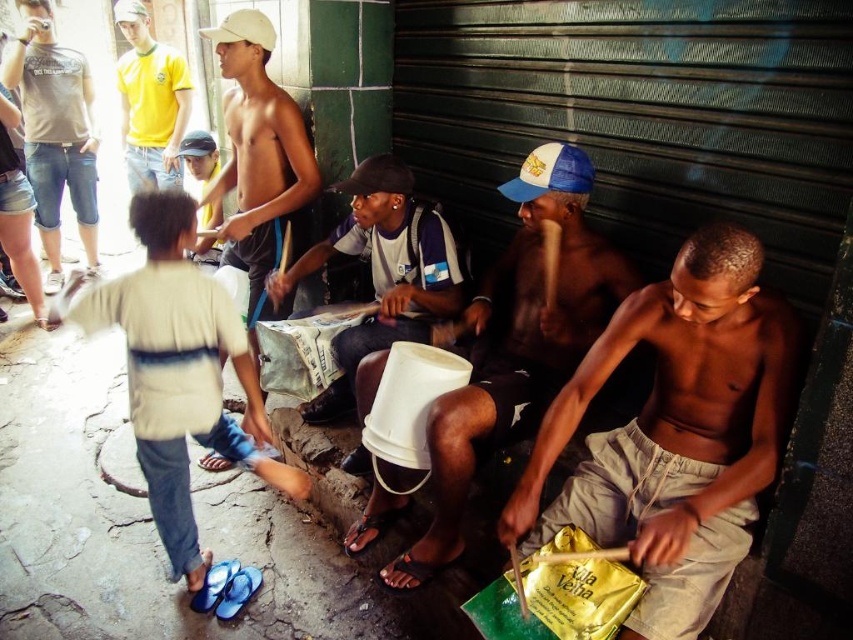
Question: Which point is farther from the camera taking this photo?

Choices:
 (A) (341, 184)
 (B) (184, 148)
 (C) (292, 291)

Answer: (B)

Question: Which object is closer to the camera taking this photo?

Choices:
 (A) black fabric cap at center
 (B) shiny white cap at upper left

Answer: (A)

Question: Among these objects, which one is farthest from the camera?

Choices:
 (A) matte gray t-shirt at center
 (B) shiny metallic boy at center

Answer: (A)

Question: Does shiny metallic boy at center have a larger size compared to white and blue fabric cap at upper center?

Choices:
 (A) no
 (B) yes

Answer: (B)

Question: Is light blue denim jeans at lower left smaller than shiny white cap at upper left?

Choices:
 (A) no
 (B) yes

Answer: (B)

Question: Can you confirm if shiny metallic boy at center is positioned to the right of white and blue fabric cap at upper center?

Choices:
 (A) yes
 (B) no

Answer: (A)